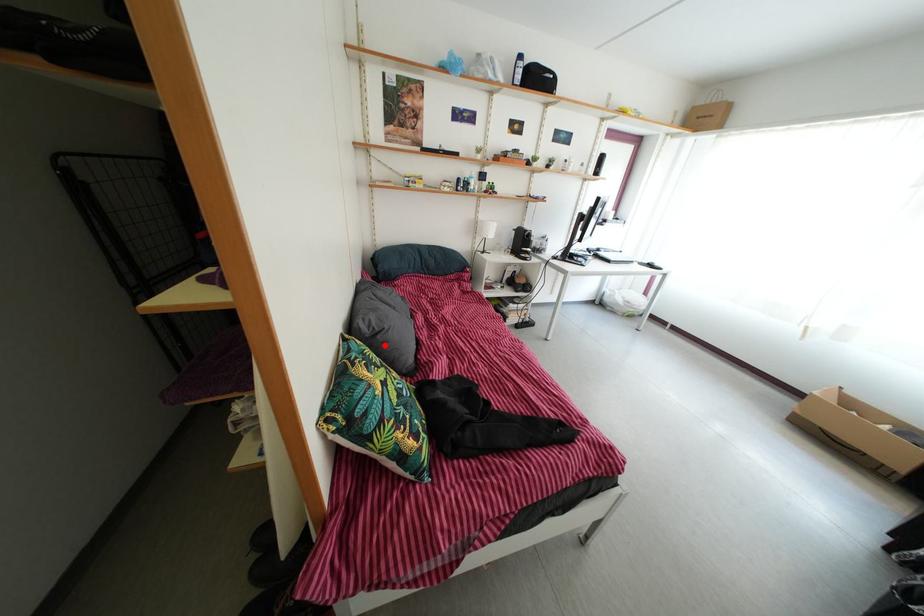
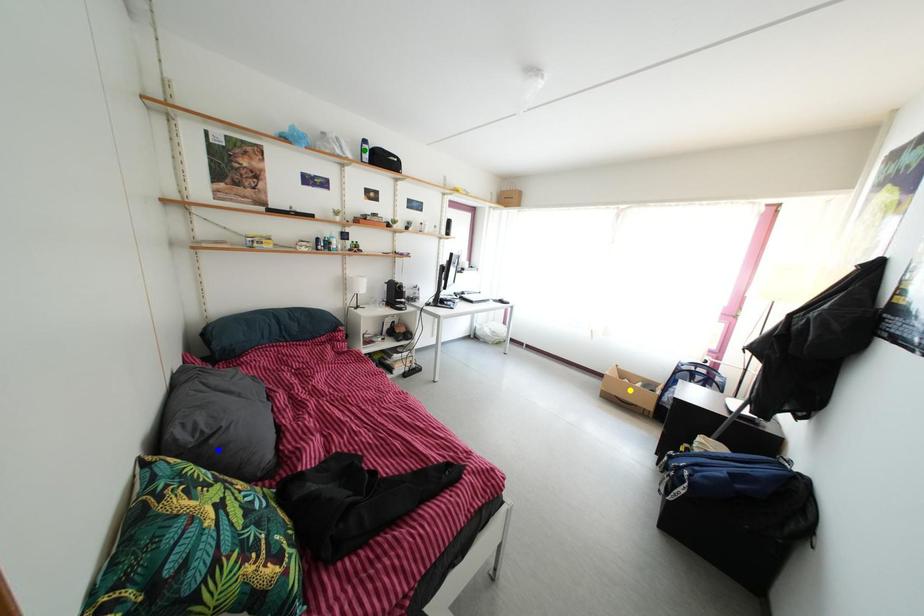
Question: I am providing you with two images of the same scene from different viewpoints. A red point is marked on the first image. You are given multiple points on the second image. Can you choose the point in image 2 that corresponds to the point in image 1?

Choices:
 (A) green point
 (B) yellow point
 (C) blue point

Answer: (C)